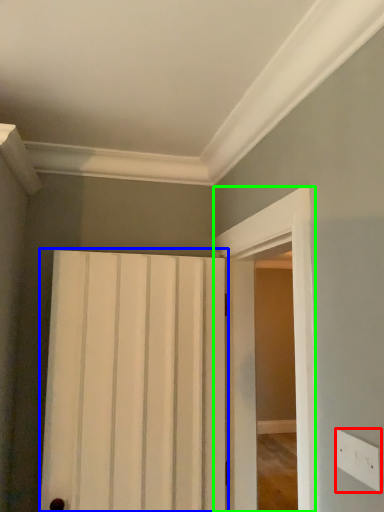
Question: Which is farther away from electric outlet (highlighted by a red box)? door (highlighted by a blue box) or screen door (highlighted by a green box)?

Choices:
 (A) door
 (B) screen door

Answer: (A)